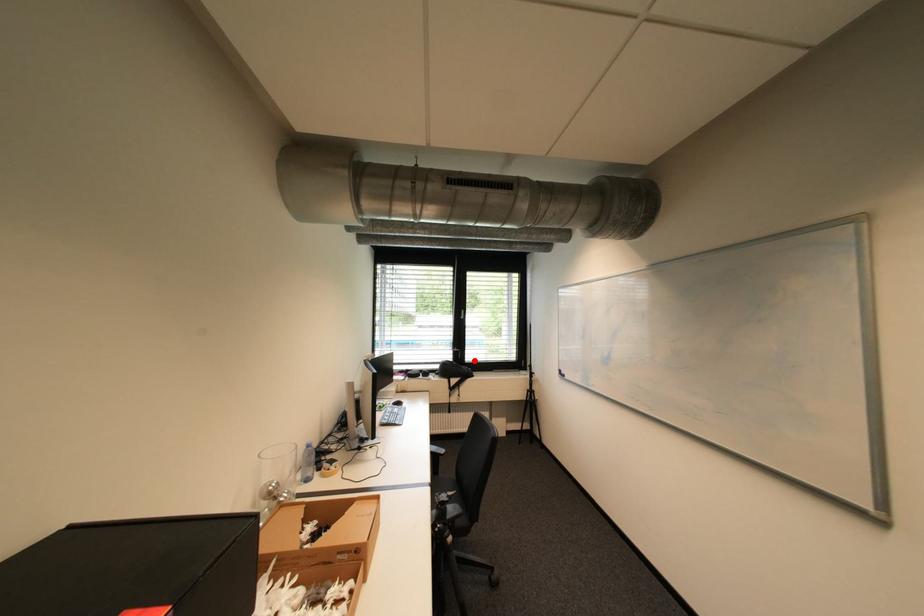
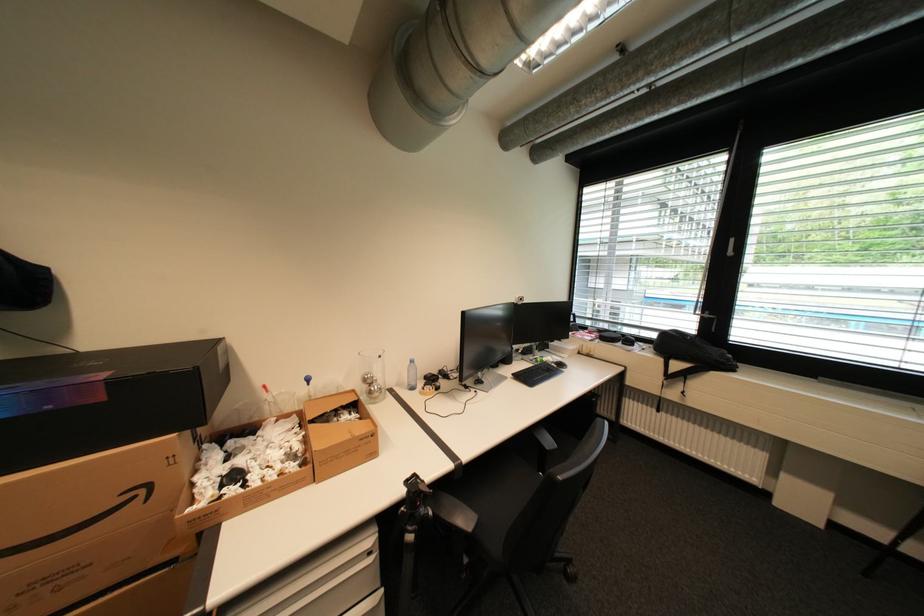
Question: I am providing you with two images of the same scene from different viewpoints. Image1 has a red point marked. In image2, the corresponding 3D location appears at what relative position? Reply with the corresponding letter.

Choices:
 (A) Closer
 (B) Farther

Answer: (A)